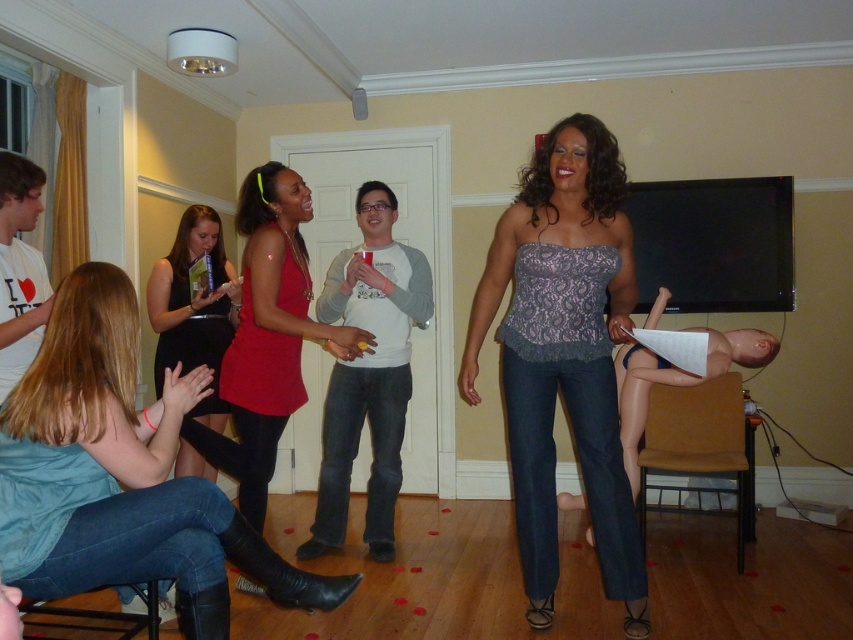
You are planning to sit between the matte red dress at center and the black satin dress at lower left. Considering their widths, which side should you choose to have more space?

You should choose the side of the matte red dress at center because its width is larger than the black satin dress at lower left, providing more space.